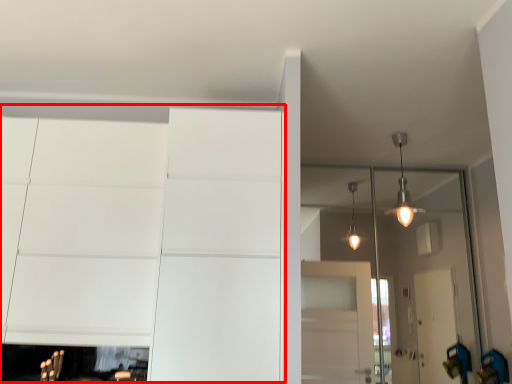
Question: From the image's perspective, where is dresser (annotated by the red box) located relative to glass door?

Choices:
 (A) below
 (B) above

Answer: (B)